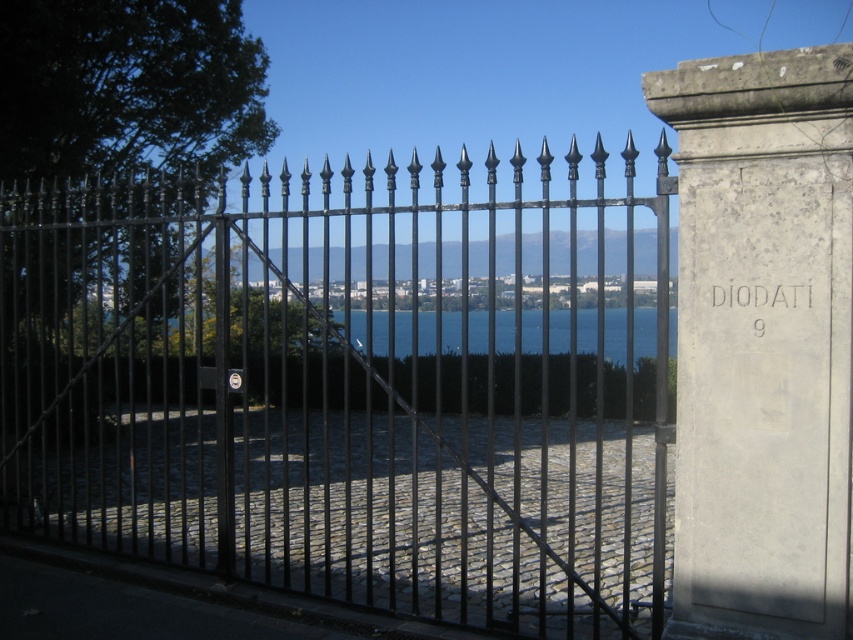
You are standing in front of the black wrought iron gate with pointed finials at the top. You want to walk towards the scenic landscape beyond the gate. The path is blocked by the closed gate with a metal bar running diagonally across the middle. However, you notice a point at coordinates point (x=347, y=387) which marks the location of the black wrought iron fence at center. Can you determine if the fence is part of the gate or a separate structure?

The point (x=347, y=387) indicates that the black wrought iron fence at center is part of the gate structure, so the fence is part of the gate.

You are a delivery person trying to determine the best way to approach the property. You see the black wrought iron fence at center and the blue glass water at center. Which one is wider?

The black wrought iron fence at center is wider than the blue glass water at center.

You are a delivery person trying to reach the address on the stone pillar to the right of the black wrought iron gate. Based on the scene, which object is closer to you, the black wrought iron fence at center or the blue glass water at center?

The black wrought iron fence at center is positioned on the left side of blue glass water at center, so the black wrought iron fence at center is closer to you.